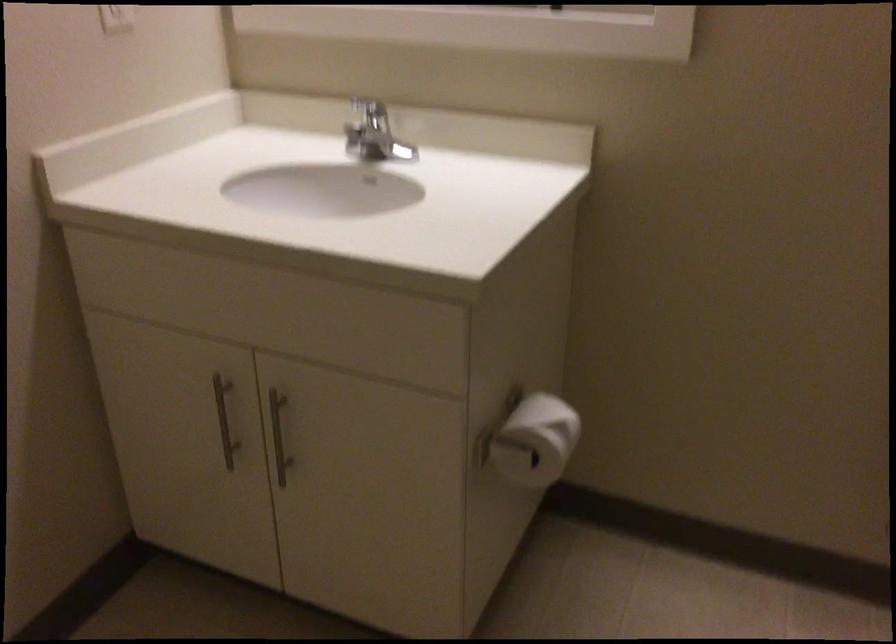
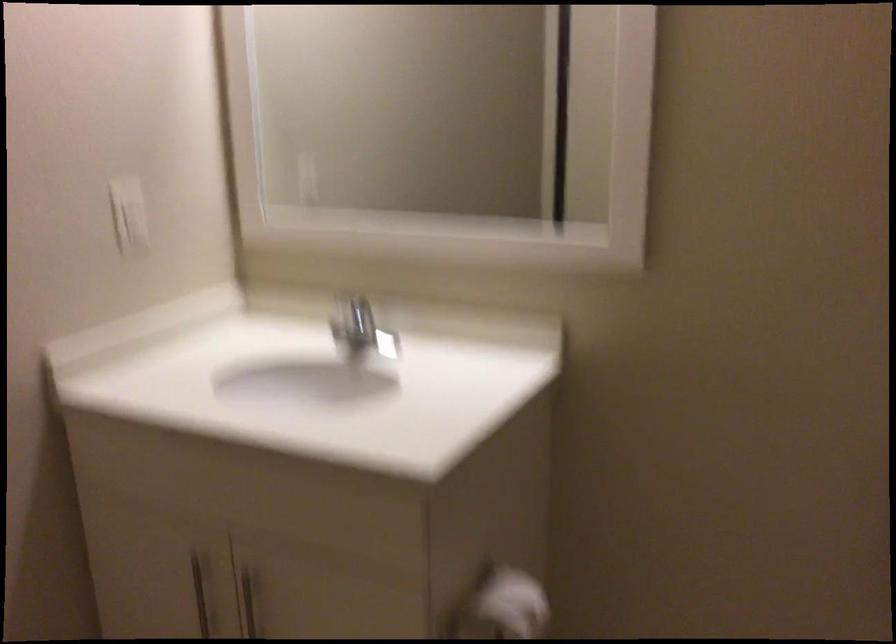
Question: How did the camera likely rotate?

Choices:
 (A) Left
 (B) Right
 (C) Up
 (D) Down

Answer: (C)